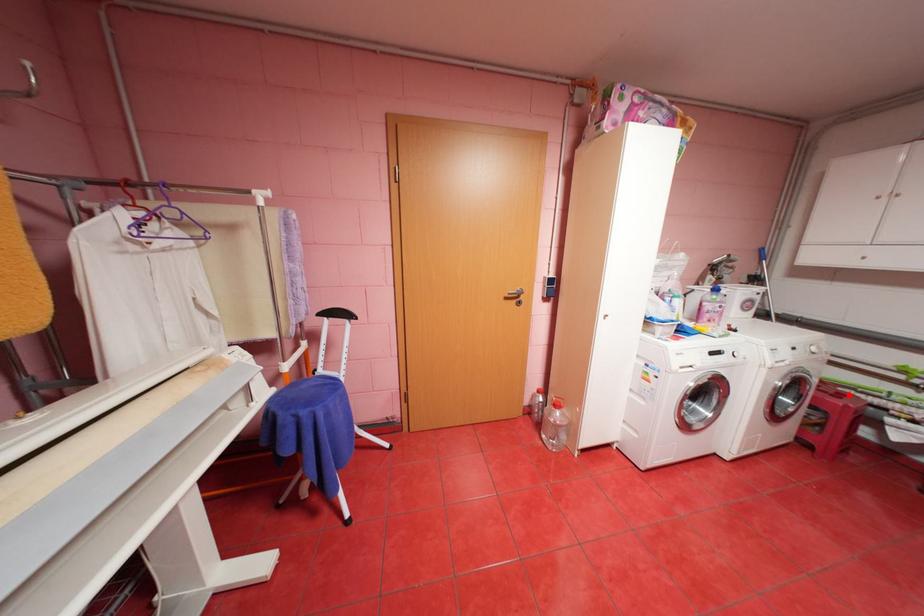
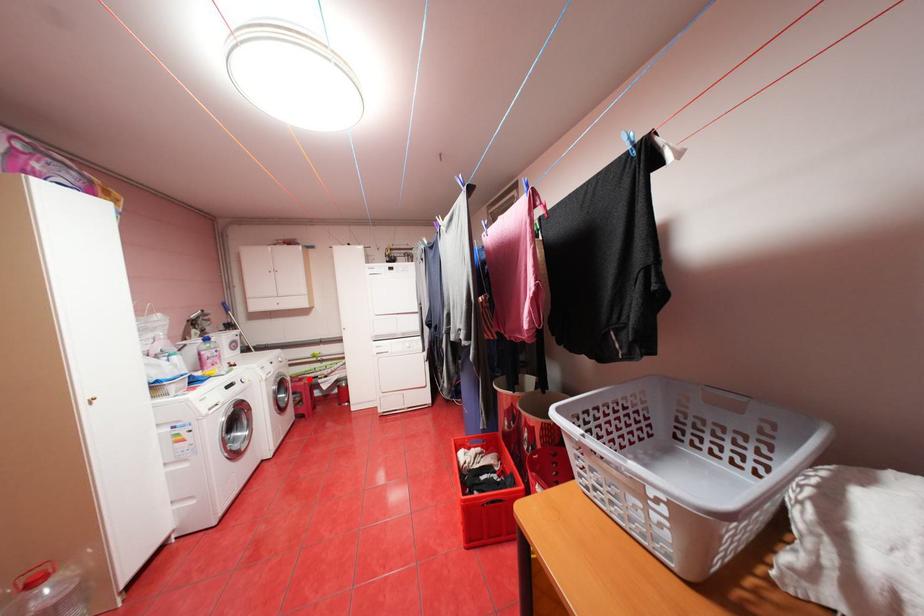
I am providing you with two images of the same scene from different viewpoints. A red point is marked on the first image and another point is marked on the second image. Is the red point in image1 aligned with the point shown in image2?

Yes